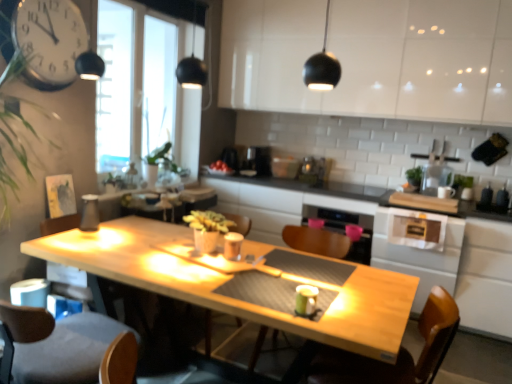
Question: Is matte glass carafe at left, the first appliance in the bottom-to-top sequence, to the right of metallic silver clock at upper left from the viewer's perspective?

Choices:
 (A) no
 (B) yes

Answer: (B)

Question: Can you confirm if matte glass carafe at left, the 1th appliance when ordered from front to back, is shorter than metallic silver clock at upper left?

Choices:
 (A) yes
 (B) no

Answer: (A)

Question: From the image's perspective, is matte glass carafe at left, acting as the 3th appliance starting from the top, located beneath metallic silver clock at upper left?

Choices:
 (A) yes
 (B) no

Answer: (A)

Question: Is matte glass carafe at left, the first appliance in the left-to-right sequence, facing towards metallic silver clock at upper left?

Choices:
 (A) yes
 (B) no

Answer: (B)

Question: Does matte glass carafe at left, the first appliance in the left-to-right sequence, come in front of metallic silver clock at upper left?

Choices:
 (A) no
 (B) yes

Answer: (A)

Question: Which is correct: metallic silver toaster at upper center, which is counted as the 2th appliance, starting from the right, is inside white glossy cabinet at upper center, or outside of it?

Choices:
 (A) inside
 (B) outside

Answer: (B)

Question: Is metallic silver toaster at upper center, the second appliance from the left, taller or shorter than white glossy cabinet at upper center?

Choices:
 (A) short
 (B) tall

Answer: (A)

Question: Is metallic silver toaster at upper center, positioned as the 3th appliance in bottom-to-top order, bigger or smaller than white glossy cabinet at upper center?

Choices:
 (A) big
 (B) small

Answer: (B)

Question: Does point (224, 152) appear closer or farther from the camera than point (465, 112)?

Choices:
 (A) farther
 (B) closer

Answer: (A)

Question: Relative to metallic silver clock at upper left, is satin silver toaster at center, placed as the third appliance when sorted from left to right, in front or behind?

Choices:
 (A) behind
 (B) front

Answer: (A)

Question: Visually, is satin silver toaster at center, placed as the third appliance when sorted from left to right, positioned to the left or to the right of metallic silver clock at upper left?

Choices:
 (A) left
 (B) right

Answer: (B)

Question: From a real-world perspective, is satin silver toaster at center, placed as the 2th appliance when sorted from top to bottom, physically located above or below metallic silver clock at upper left?

Choices:
 (A) below
 (B) above

Answer: (A)

Question: From the image's perspective, is satin silver toaster at center, placed as the third appliance when sorted from left to right, positioned above or below metallic silver clock at upper left?

Choices:
 (A) above
 (B) below

Answer: (B)

Question: In the image, is matte glass carafe at left, the third appliance when ordered from right to left, positioned in front of or behind wooden armchair at center, the second armchair when ordered from right to left?

Choices:
 (A) behind
 (B) front

Answer: (B)

Question: From a real-world perspective, relative to wooden armchair at center, the 1th armchair positioned from the left, is matte glass carafe at left, the third appliance when ordered from right to left, vertically above or below?

Choices:
 (A) below
 (B) above

Answer: (B)